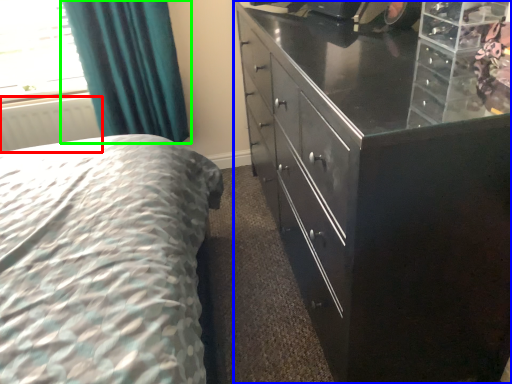
Question: Which object is positioned closest to radiator (highlighted by a red box)? Select from chest of drawers (highlighted by a blue box) and curtain (highlighted by a green box).

Choices:
 (A) chest of drawers
 (B) curtain

Answer: (B)